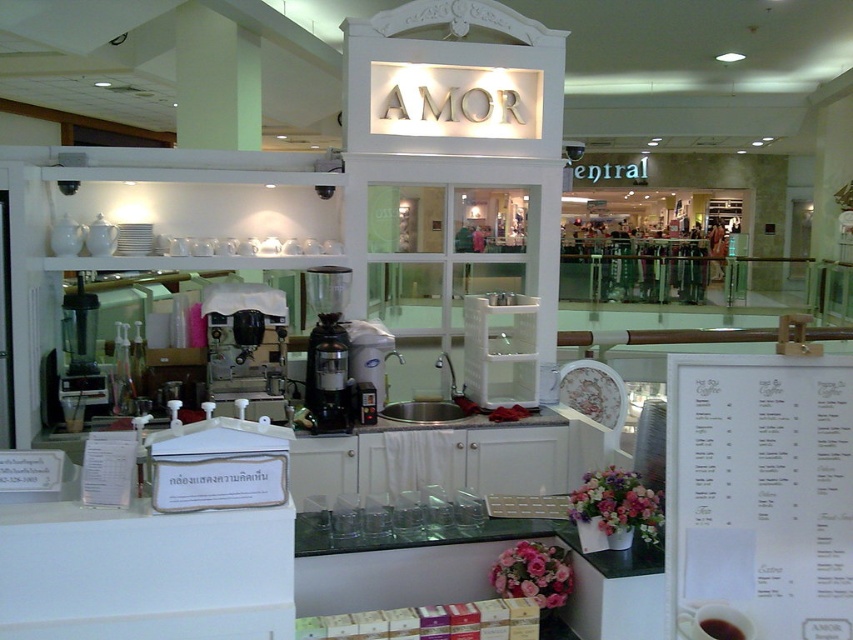
Between point (91, 403) and point (735, 625), which one is positioned in front?

Positioned in front is point (735, 625).

Does matte black blender at left have a lesser width compared to black matte cup at center?

No, matte black blender at left is not thinner than black matte cup at center.

Who is more distant from viewer, (96, 390) or (730, 628)?

Point (96, 390)

In order to click on matte black blender at left in this screenshot , I will do `click(80, 358)`.

Where is `matte black blender at left`? Image resolution: width=853 pixels, height=640 pixels. matte black blender at left is located at coordinates (80, 358).

Is matte black blender at left taller than black glossy cup at lower right?

Correct, matte black blender at left is much taller as black glossy cup at lower right.

Who is more forward, (74, 413) or (715, 625)?

Point (715, 625) is more forward.

At what (x,y) coordinates should I click in order to perform the action: click on matte black blender at left. Please return your answer as a coordinate pair (x, y). This screenshot has width=853, height=640. Looking at the image, I should click on (80, 358).

Can you confirm if black matte coffee grinder at center is wider than black matte cup at center?

Indeed, black matte coffee grinder at center has a greater width compared to black matte cup at center.

Is black matte coffee grinder at center thinner than black matte cup at center?

No, black matte coffee grinder at center is not thinner than black matte cup at center.

Locate an element on the screen. black matte coffee grinder at center is located at coordinates (328, 352).

Image resolution: width=853 pixels, height=640 pixels. I want to click on black matte coffee grinder at center, so click(328, 352).